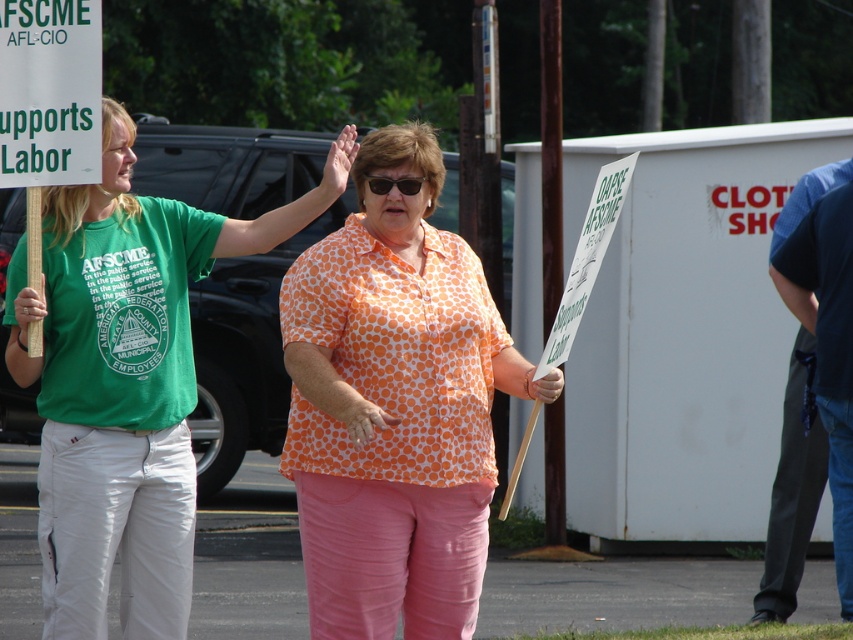
Question: Which object is closer to the camera taking this photo?

Choices:
 (A) orange dotted shirt at center
 (B) green fabric shirt at left

Answer: (A)

Question: Among these points, which one is nearest to the camera?

Choices:
 (A) (131, 365)
 (B) (410, 186)
 (C) (440, 292)

Answer: (B)

Question: Which object is positioned closest to the green fabric shirt at left?

Choices:
 (A) orange dotted shirt at center
 (B) black plastic sunglasses at center

Answer: (A)

Question: Can you confirm if orange dotted shirt at center is positioned below black plastic sunglasses at center?

Choices:
 (A) no
 (B) yes

Answer: (B)

Question: Is green fabric shirt at left further to camera compared to black plastic sunglasses at center?

Choices:
 (A) yes
 (B) no

Answer: (B)

Question: Can you confirm if green fabric shirt at left is positioned below black plastic sunglasses at center?

Choices:
 (A) yes
 (B) no

Answer: (A)